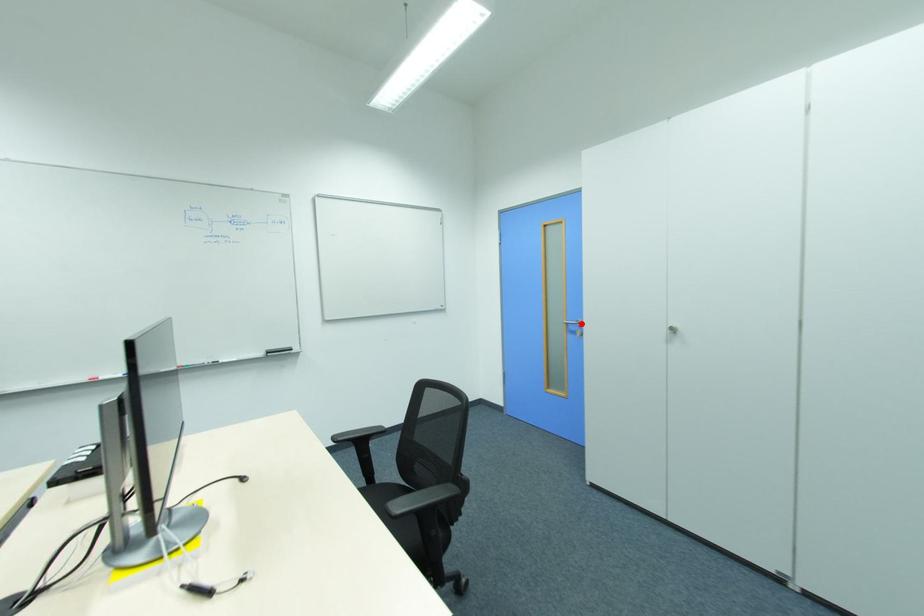
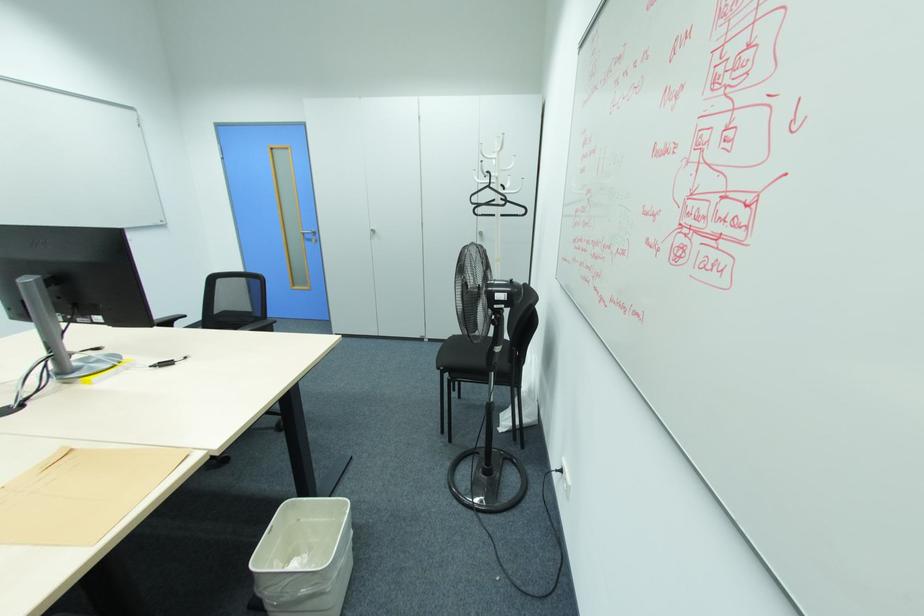
In the second image, find the point that corresponds to the highlighted location in the first image.

(314, 233)